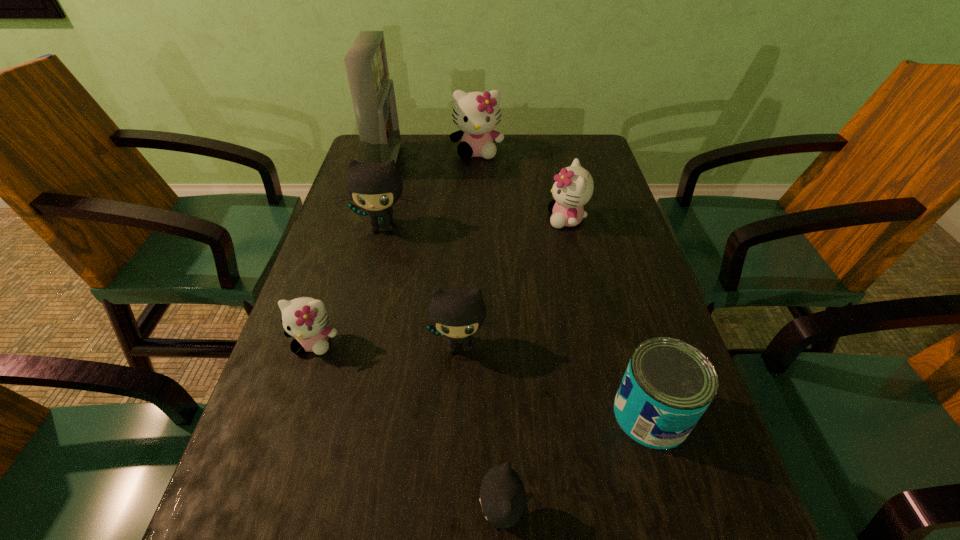
This screenshot has width=960, height=540. What are the coordinates of `the tallest object` in the screenshot? It's located at (372, 92).

Locate an element on the screen. Image resolution: width=960 pixels, height=540 pixels. red first-aid kit is located at coordinates (372, 92).

Identify the location of the farthest white kitten. (476, 114).

Where is `the second white kitten from left to right`? The width and height of the screenshot is (960, 540). the second white kitten from left to right is located at coordinates (476, 114).

The height and width of the screenshot is (540, 960). In order to click on the leftmost gray kitten in this screenshot , I will do `click(374, 186)`.

Image resolution: width=960 pixels, height=540 pixels. I want to click on the biggest gray kitten, so click(x=374, y=186).

This screenshot has height=540, width=960. Identify the location of the second biggest white kitten. (573, 188).

The height and width of the screenshot is (540, 960). In order to click on the rightmost white kitten in this screenshot , I will do `click(573, 188)`.

Where is `the second biggest gray kitten`? This screenshot has width=960, height=540. the second biggest gray kitten is located at coordinates (457, 313).

Find the location of `the second nearest object`. the second nearest object is located at coordinates (668, 384).